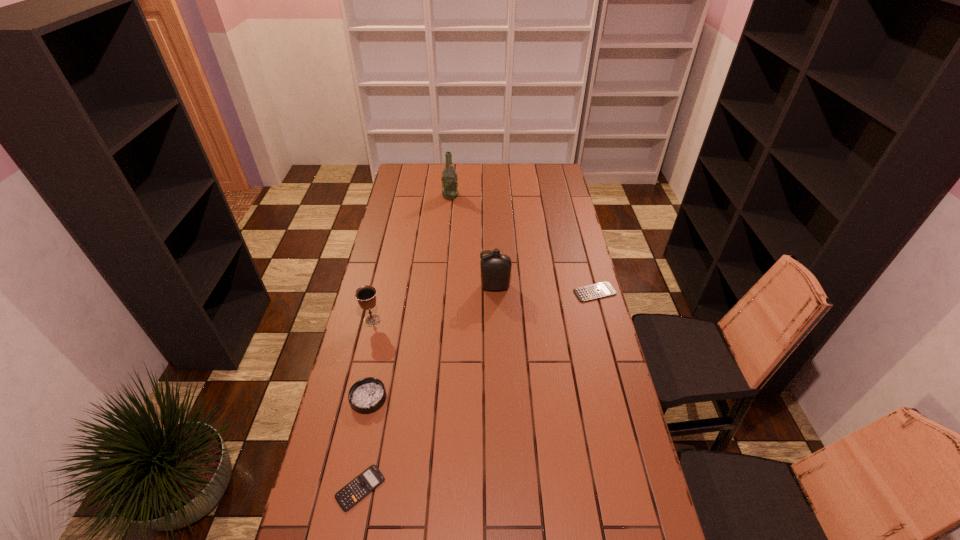
Locate an element on the screen. This screenshot has width=960, height=540. the fourth closest object to the nearest object is located at coordinates (599, 290).

Find the location of a particular element. The image size is (960, 540). vacant space that satisfies the following two spatial constraints: 1. on the surface of the fourth object from left to right; 2. on the left side of the second object from right to left is located at coordinates (443, 287).

Locate an element on the screen. The height and width of the screenshot is (540, 960). free space that satisfies the following two spatial constraints: 1. on the surface of the beer bottle; 2. on the front side of the second nearest object is located at coordinates (432, 398).

Where is `vacant space that satisfies the following two spatial constraints: 1. on the surface of the beer bottle; 2. on the back side of the bottle`? This screenshot has width=960, height=540. vacant space that satisfies the following two spatial constraints: 1. on the surface of the beer bottle; 2. on the back side of the bottle is located at coordinates (443, 287).

This screenshot has height=540, width=960. I want to click on free location that satisfies the following two spatial constraints: 1. on the front side of the fourth shortest object; 2. on the right side of the second nearest object, so click(x=353, y=398).

Locate an element on the screen. The height and width of the screenshot is (540, 960). free spot that satisfies the following two spatial constraints: 1. on the surface of the beer bottle; 2. on the front side of the ashtray is located at coordinates (432, 398).

The image size is (960, 540). I want to click on free space that satisfies the following two spatial constraints: 1. on the front side of the third nearest object; 2. on the right side of the fifth farthest object, so [353, 398].

Identify the location of vacant point that satisfies the following two spatial constraints: 1. on the surface of the fifth tallest object; 2. on the left side of the tallest object. (442, 292).

Locate an element on the screen. This screenshot has width=960, height=540. free space in the image that satisfies the following two spatial constraints: 1. on the back side of the ashtray; 2. on the right side of the second tallest object is located at coordinates (392, 287).